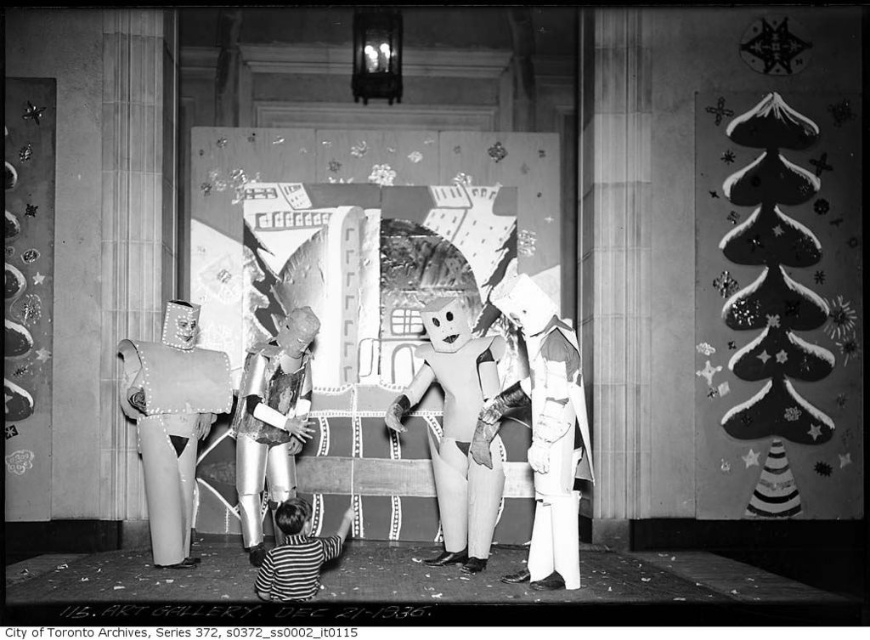
Question: Which point is farther from the camera taking this photo?

Choices:
 (A) (283, 520)
 (B) (161, 358)
 (C) (541, 481)
 (D) (390, 410)

Answer: (D)

Question: Does black paper christmas tree at right appear on the left side of cardboard robot at center?

Choices:
 (A) no
 (B) yes

Answer: (A)

Question: Which object appears closest to the camera in this image?

Choices:
 (A) striped cotton shirt at lower center
 (B) smooth cardboard robot at left

Answer: (A)

Question: Which object is positioned closest to the shiny silver robot at center?

Choices:
 (A) smooth cardboard robot at left
 (B) smooth cardboard robot at center
 (C) striped cotton shirt at lower center

Answer: (A)

Question: Does cardboard robot at center appear over shiny silver robot at center?

Choices:
 (A) yes
 (B) no

Answer: (A)

Question: Does black paper christmas tree at right appear over cardboard robot at center?

Choices:
 (A) no
 (B) yes

Answer: (B)